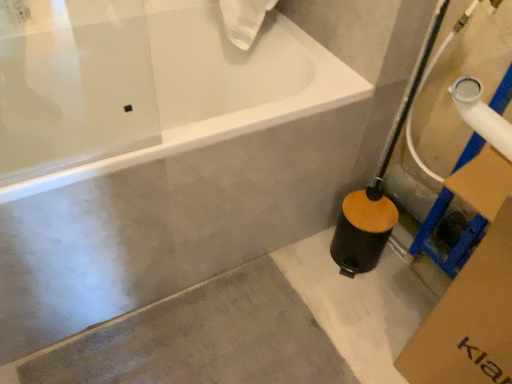
You are a GUI agent. You are given a task and a screenshot of the screen. Output one action in this format:
    pyautogui.click(x=<x>, y=<y>)
    Task: Click on the empty space that is ontop of gray concrete at lower left (from a real-world perspective)
    The height and width of the screenshot is (384, 512).
    Given the screenshot: What is the action you would take?
    pyautogui.click(x=259, y=329)